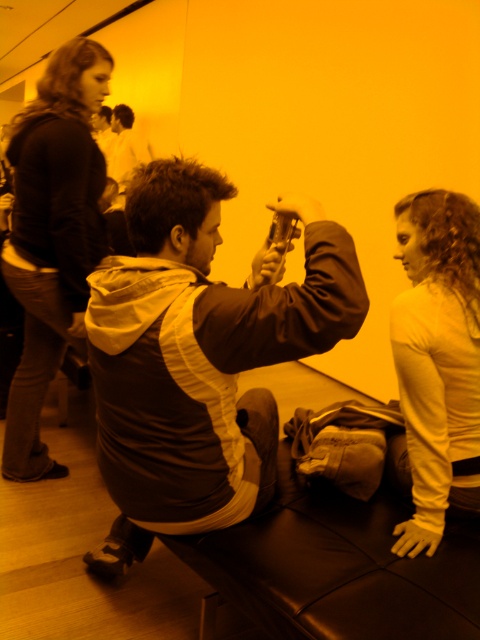
You are standing in the room and want to hand the matte brown jacket at center to the person on the right. Is the jacket closer to the seated person or the person on the right?

The matte brown jacket at center is located at point (200, 356), which is closer to the seated person than the person on the right. Therefore, the jacket is closer to the seated person.